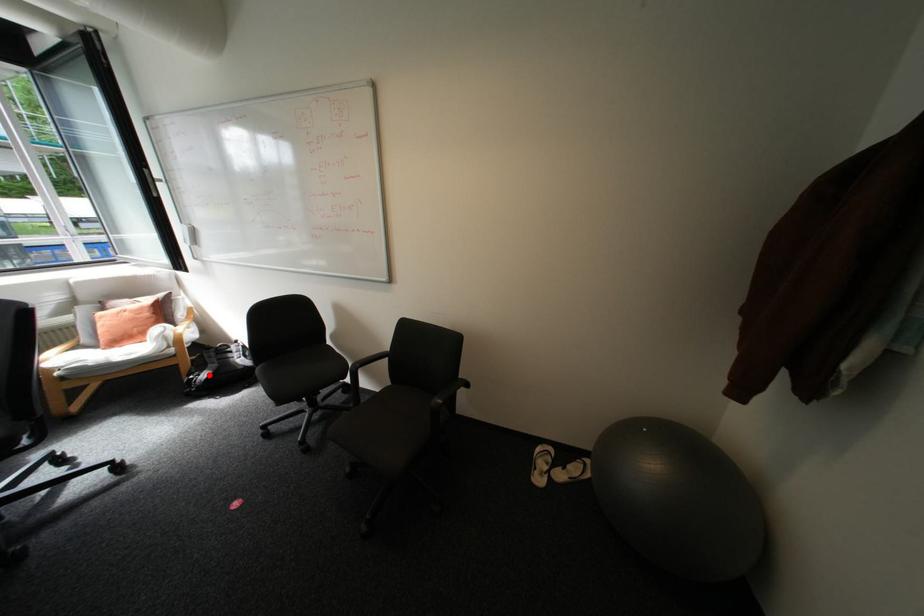
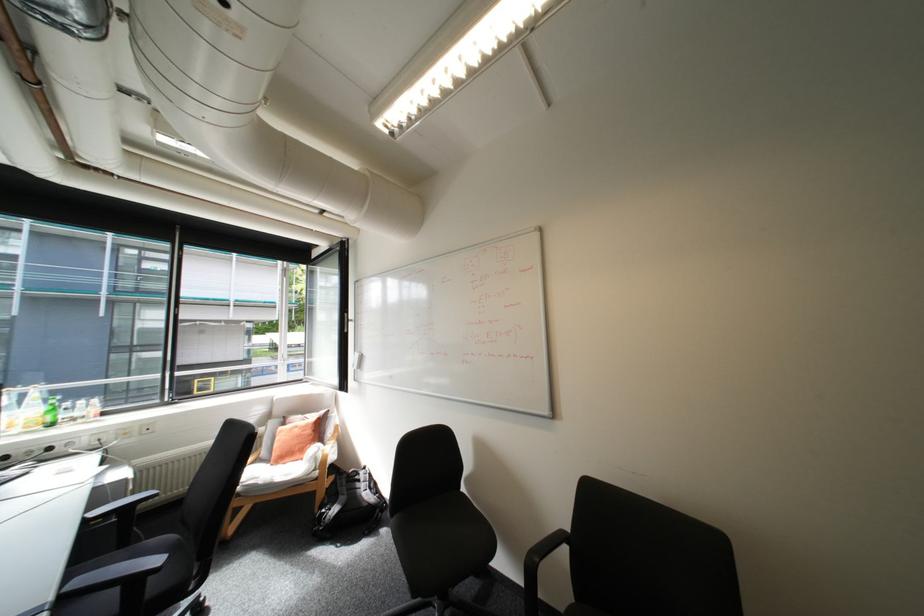
Find the pixel in the second image that matches the highlighted location in the first image.

(339, 509)